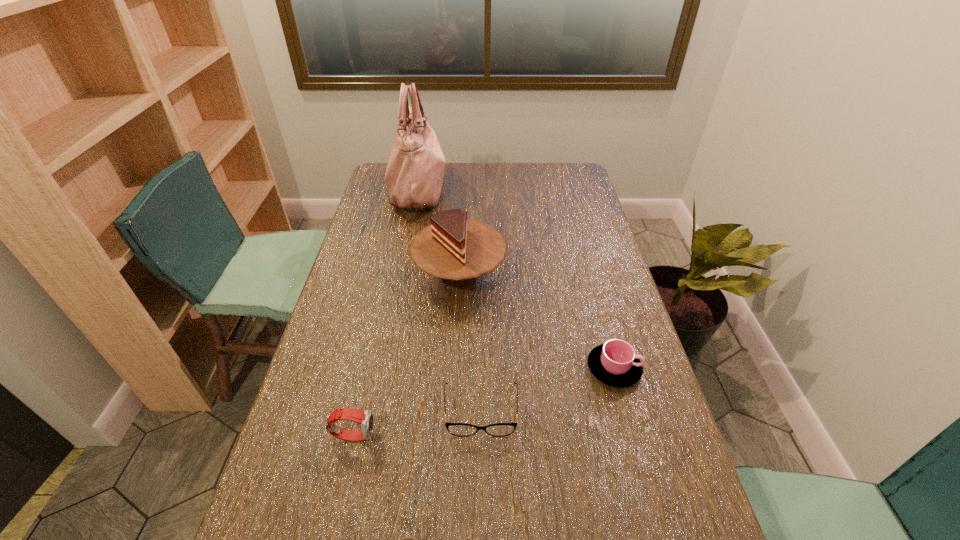
You are a GUI agent. You are given a task and a screenshot of the screen. Output one action in this format:
    pyautogui.click(x=<x>, y=<y>)
    Task: Click on the vacant point at the right edge
    
    Given the screenshot: What is the action you would take?
    pyautogui.click(x=588, y=291)

Find the location of a particular element. vacant region at the far right corner is located at coordinates (560, 177).

Find the location of a particular element. unoccupied position between the left watch and the fourth tallest object is located at coordinates (484, 402).

The height and width of the screenshot is (540, 960). In order to click on free space between the fifth nearest object and the spectacles in this screenshot , I will do `click(470, 343)`.

Find the location of a particular element. unoccupied area between the farther watch and the cup is located at coordinates (484, 402).

The image size is (960, 540). Find the location of `vacant region between the spectacles and the third shortest object`. vacant region between the spectacles and the third shortest object is located at coordinates (547, 390).

At what (x,y) coordinates should I click in order to perform the action: click on vacant region between the spectacles and the left watch. Please return your answer as a coordinate pair (x, y). Looking at the image, I should click on (418, 423).

Identify the location of empty space that is in between the left watch and the handbag. (385, 312).

Where is `free point between the cup and the taller watch`? The height and width of the screenshot is (540, 960). free point between the cup and the taller watch is located at coordinates (484, 402).

Locate an element on the screen. Image resolution: width=960 pixels, height=540 pixels. object that stands as the fifth closest to the rightmost object is located at coordinates (414, 175).